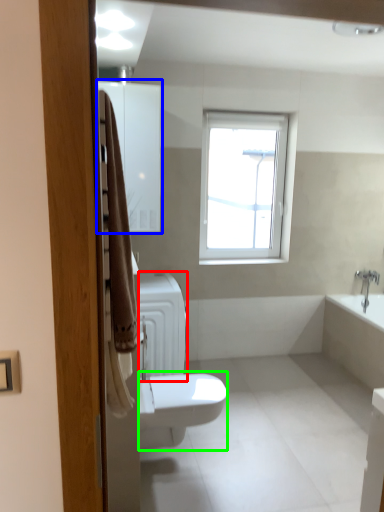
Question: Estimate the real-world distances between objects in this image. Which object is closer to radiator (highlighted by a red box), medicine cabinet (highlighted by a blue box) or bidet (highlighted by a green box)?

Choices:
 (A) medicine cabinet
 (B) bidet

Answer: (B)